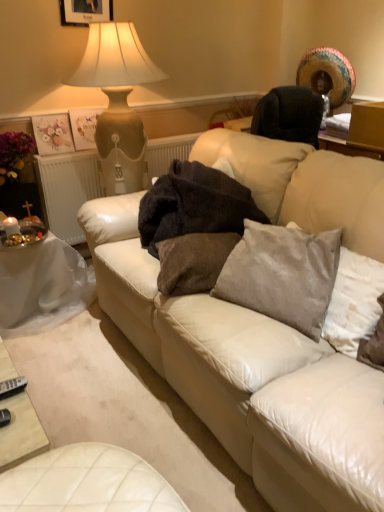
Question: Relative to white plastic table at lower left, is dark brown plush blanket at center in front or behind?

Choices:
 (A) behind
 (B) front

Answer: (B)

Question: From a real-world perspective, is dark brown plush blanket at center positioned above or below white plastic table at lower left?

Choices:
 (A) above
 (B) below

Answer: (A)

Question: Which is farther from the matte white picture frame at upper center?

Choices:
 (A) brown velvet pillow at center, acting as the 1th pillow starting from the left
 (B) white leather couch at center
 (C) white textured radiator at left
 (D) satin gray pillow at center, the second pillow viewed from the left
 (E) silver metallic remote at lower left

Answer: (E)

Question: Which object is the farthest from the brown velvet pillow at center, acting as the 1th pillow starting from the left?

Choices:
 (A) silver metallic remote at lower left
 (B) dark brown plush blanket at center
 (C) satin gray pillow at center, the second pillow viewed from the left
 (D) white textured radiator at left
 (E) white leather couch at center

Answer: (D)